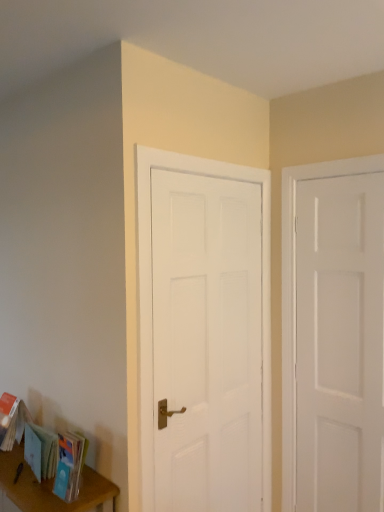
You are a GUI agent. You are given a task and a screenshot of the screen. Output one action in this format:
    pyautogui.click(x=<x>, y=<y>)
    Task: Click on the free space above white matte door at center, which appears as the first door when viewed from the left (from a real-world perspective)
    This screenshot has height=512, width=384.
    Given the screenshot: What is the action you would take?
    pyautogui.click(x=212, y=157)